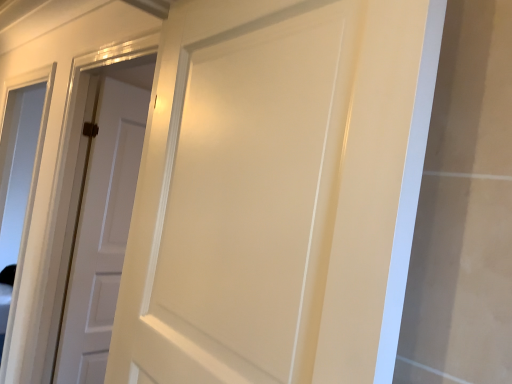
Question: Is transparent glass window at left positioned behind matte white door at center, marked as the first door in a right-to-left arrangement?

Choices:
 (A) no
 (B) yes

Answer: (B)

Question: Is transparent glass window at left outside matte white door at center, positioned as the 2th door in back-to-front order?

Choices:
 (A) no
 (B) yes

Answer: (B)

Question: Can you confirm if transparent glass window at left is positioned to the left of matte white door at center, positioned as the 2th door in back-to-front order?

Choices:
 (A) no
 (B) yes

Answer: (B)

Question: Is transparent glass window at left aimed at matte white door at center, positioned as the 2th door in back-to-front order?

Choices:
 (A) yes
 (B) no

Answer: (B)

Question: Considering the relative sizes of transparent glass window at left and matte white door at center, acting as the first door starting from the front, in the image provided, is transparent glass window at left wider than matte white door at center, acting as the first door starting from the front,?

Choices:
 (A) yes
 (B) no

Answer: (B)

Question: Do you think transparent glass window at left is within matte white door at center, acting as the second door starting from the left, or outside of it?

Choices:
 (A) outside
 (B) inside

Answer: (A)

Question: Would you say transparent glass window at left is to the left or to the right of matte white door at center, acting as the second door starting from the left, in the picture?

Choices:
 (A) left
 (B) right

Answer: (A)

Question: From a real-world perspective, is transparent glass window at left above or below matte white door at center, acting as the first door starting from the front?

Choices:
 (A) above
 (B) below

Answer: (B)

Question: Considering the positions of transparent glass window at left and matte white door at center, marked as the first door in a right-to-left arrangement, in the image, is transparent glass window at left wider or thinner than matte white door at center, marked as the first door in a right-to-left arrangement,?

Choices:
 (A) thin
 (B) wide

Answer: (A)

Question: Choose the correct answer: Is matte white door at center, positioned as the 2th door in back-to-front order, inside white matte door at center, which ranks as the second door in right-to-left order, or outside it?

Choices:
 (A) inside
 (B) outside

Answer: (B)

Question: Is matte white door at center, marked as the first door in a right-to-left arrangement, taller or shorter than white matte door at center, which is the 1th door from back to front?

Choices:
 (A) short
 (B) tall

Answer: (A)

Question: Considering the positions of matte white door at center, positioned as the 2th door in back-to-front order, and white matte door at center, marked as the 1th door in a left-to-right arrangement, in the image, is matte white door at center, positioned as the 2th door in back-to-front order, bigger or smaller than white matte door at center, marked as the 1th door in a left-to-right arrangement,?

Choices:
 (A) big
 (B) small

Answer: (A)

Question: Considering the positions of matte white door at center, positioned as the 2th door in back-to-front order, and white matte door at center, which ranks as the second door in right-to-left order, in the image, is matte white door at center, positioned as the 2th door in back-to-front order, wider or thinner than white matte door at center, which ranks as the second door in right-to-left order,?

Choices:
 (A) wide
 (B) thin

Answer: (A)

Question: From their relative heights in the image, would you say transparent glass window at left is taller or shorter than white matte door at center, marked as the 1th door in a left-to-right arrangement?

Choices:
 (A) tall
 (B) short

Answer: (A)

Question: Considering the relative positions of transparent glass window at left and white matte door at center, which ranks as the second door in right-to-left order, in the image provided, is transparent glass window at left to the left or to the right of white matte door at center, which ranks as the second door in right-to-left order,?

Choices:
 (A) right
 (B) left

Answer: (B)